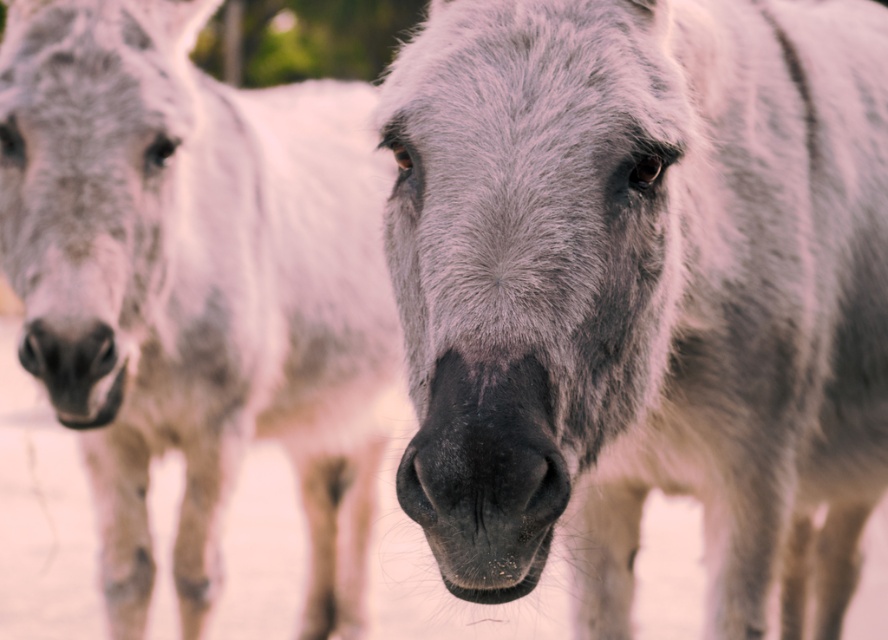
You are a photographer standing at the origin point of the image coordinate system. You want to take a photo of the fuzzy white donkey at center. What are the coordinates where you should aim your camera?

The coordinates where you should aim your camera are at point [641,289].

You are a photographer trying to capture a clear shot of the fuzzy white donkey at center. You notice a point marked at coordinates (641, 289). Where is this point located on the fuzzy white donkey at center?

The point at coordinates (641, 289) is located on the fuzzy white donkey at center.